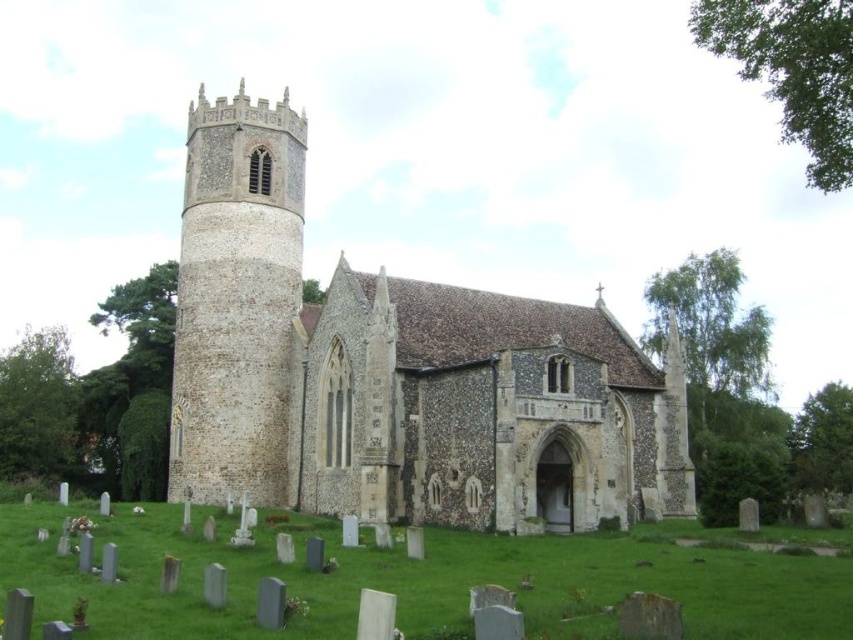
You are an architect assessing the structural integrity of the stone church at center and the stone tower at left. Based on their heights, which structure might require additional support for its foundation?

The stone church at center has a greater height compared to the stone tower at left, so it might require additional support for its foundation due to its increased height.

You are standing in front of the church and notice two points marked on the church facade. The first point is at coordinates point (225, 209) and the second is at point (242, 150). From your perspective, which point is closer to you?

Point (225, 209) is in front of point (242, 150), so it is closer to you.

Based on the scene description, what is the 2D coordinate position of the stone church at center?

The stone church at center is located at the 2D coordinate point of (395, 371).